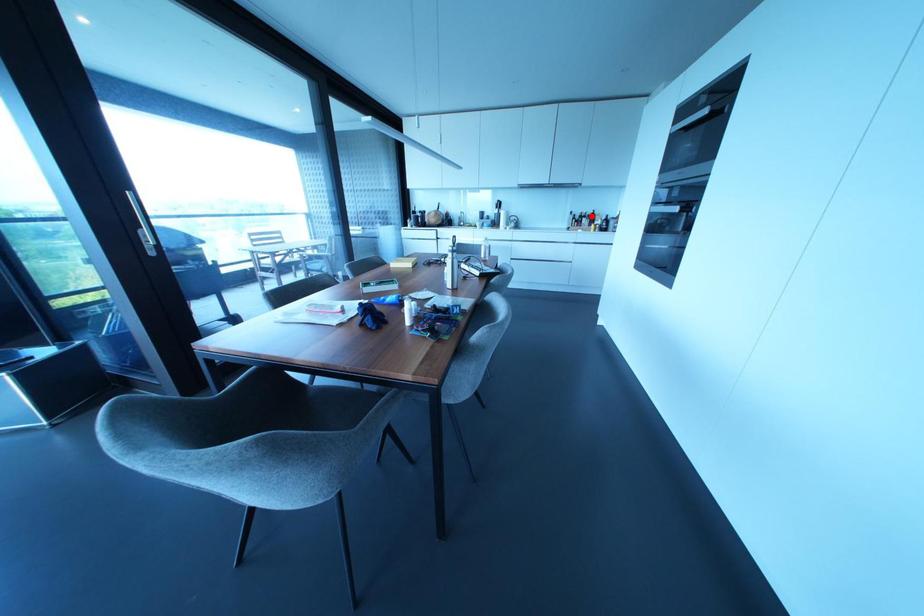
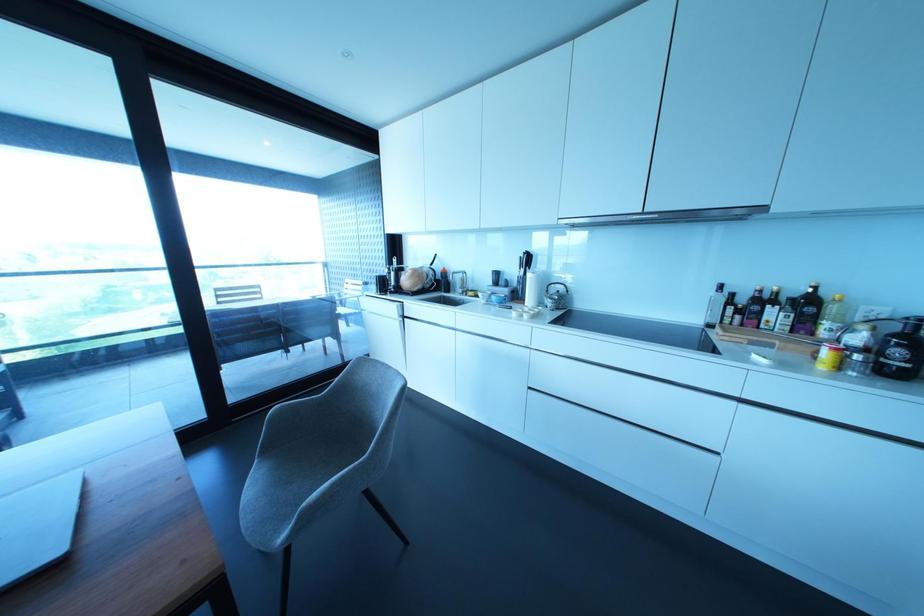
Where in the second image is the point corresponding to the highlighted location from the first image?

(807, 304)